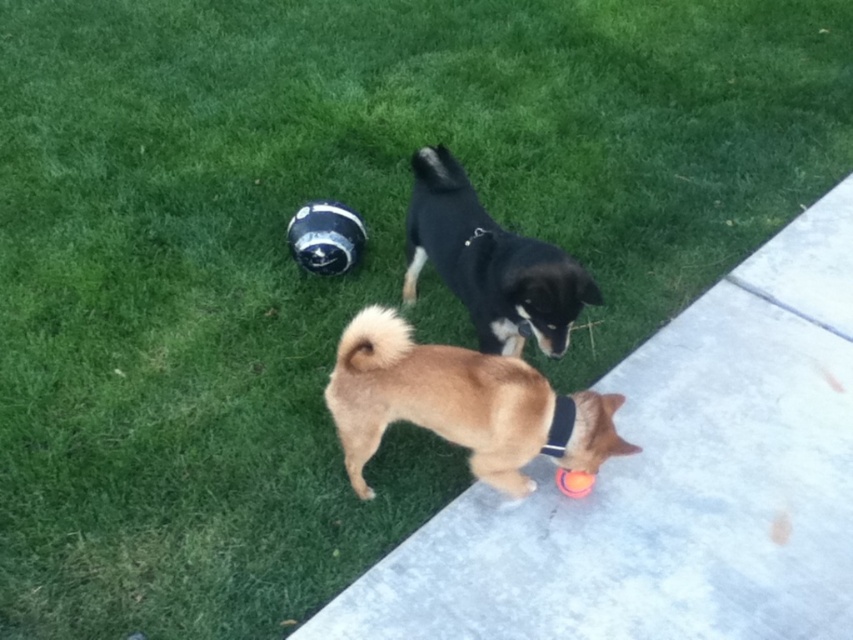
You are standing at the edge of the grassy area and want to walk to the concrete at lower right without stepping on the brown furry dog at lower center. Is this possible based on their positions?

The concrete at lower right is positioned over brown furry dog at lower lower center, so you can walk to the concrete at lower right without stepping on the brown furry dog at lower center because it is elevated above the dog.